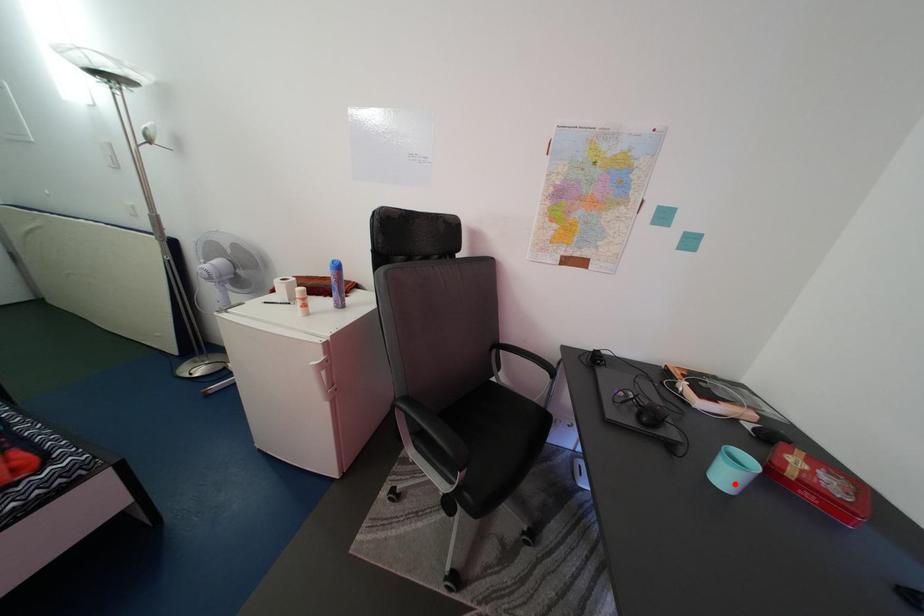
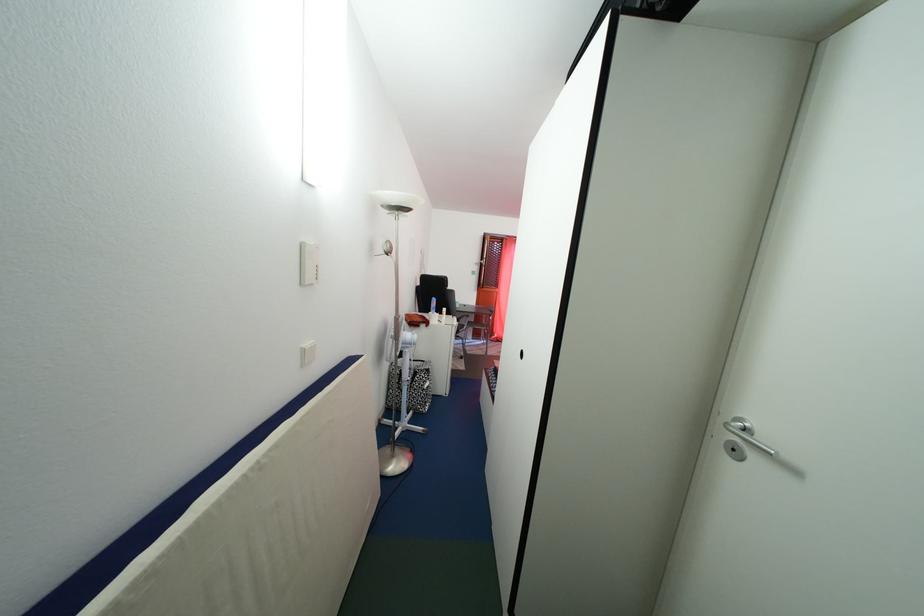
In the second image, find the point that corresponds to the highlighted location in the first image.

(466, 313)